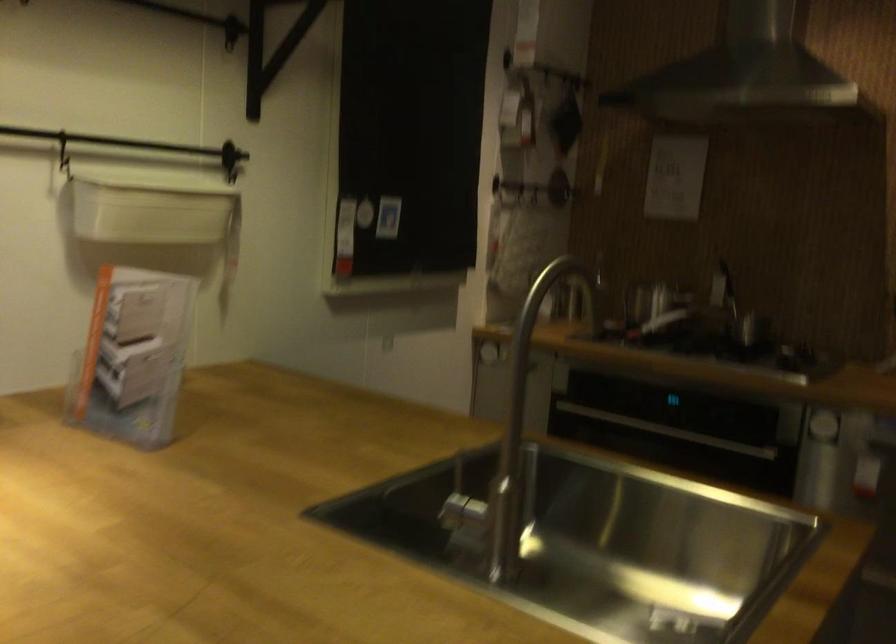
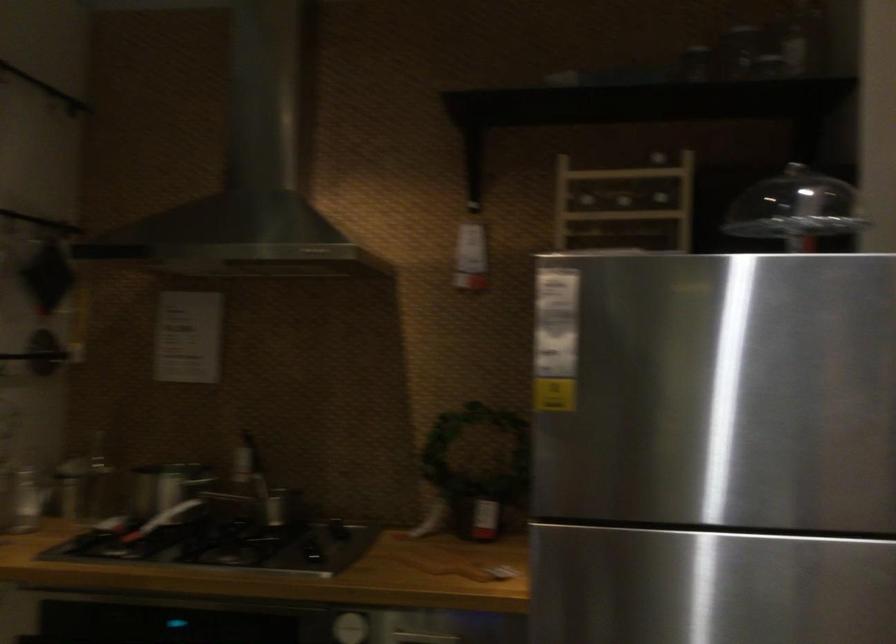
The point at (x=728, y=278) is marked in the first image. Where is the corresponding point in the second image?

(243, 459)